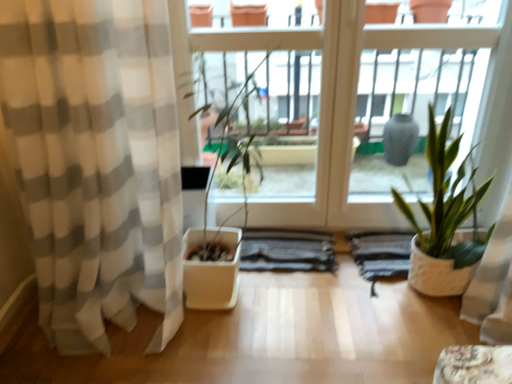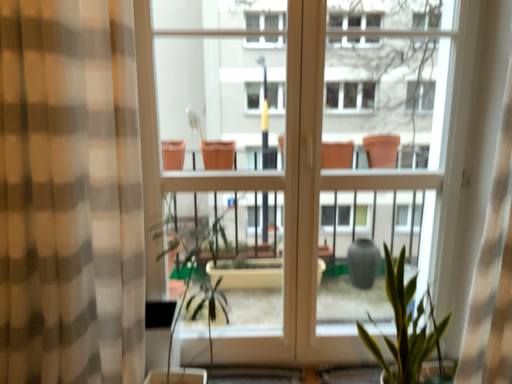
Question: Which way did the camera rotate in the video?

Choices:
 (A) rotated upward
 (B) rotated downward

Answer: (A)